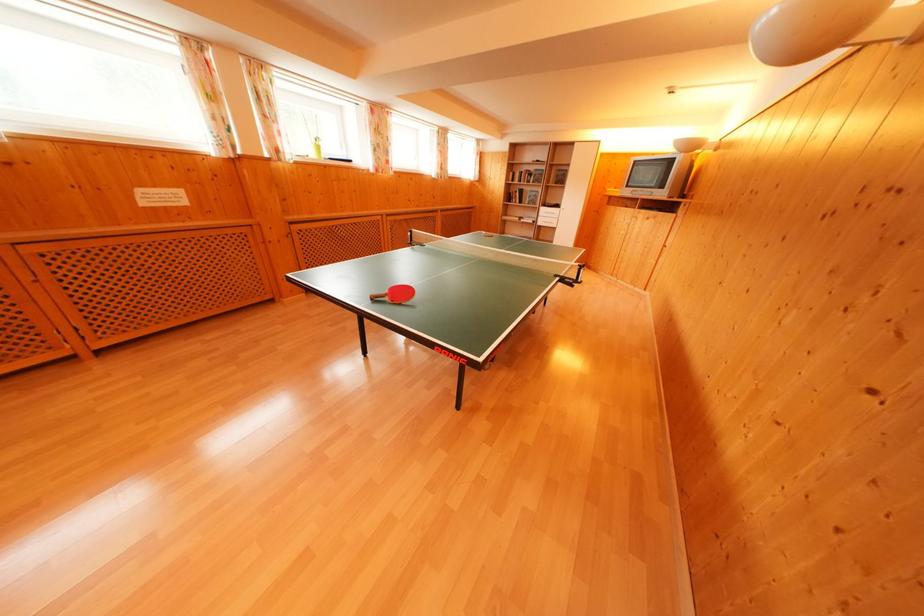
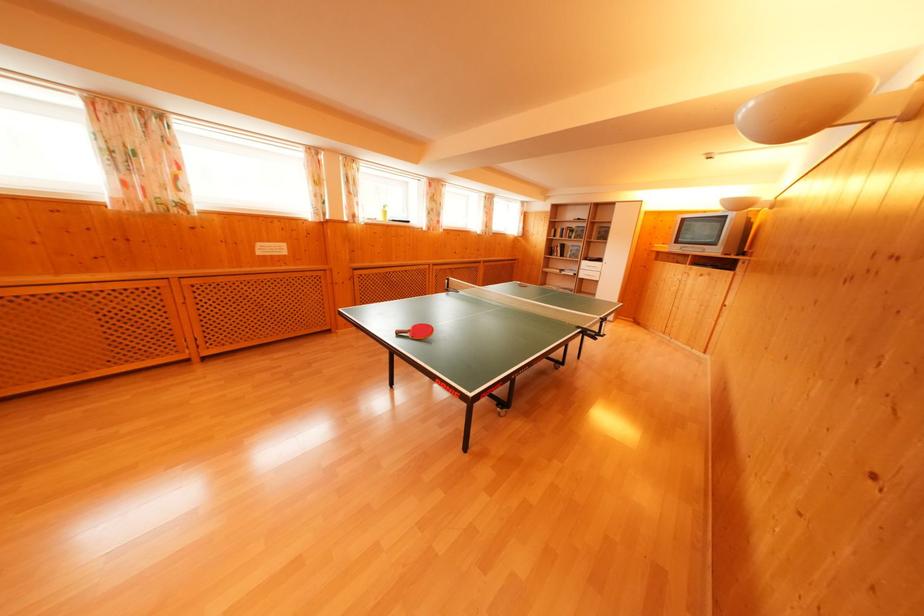
In a continuous first-person perspective shot, in which direction is the camera moving?

The cameraman walked toward right, backward.